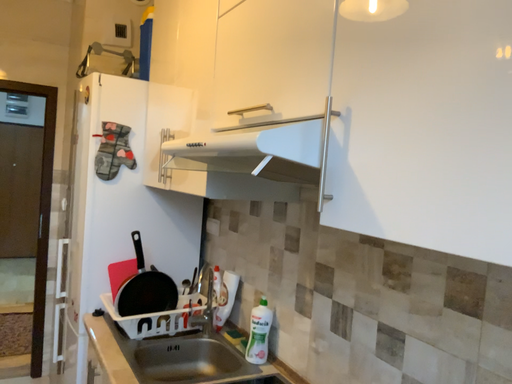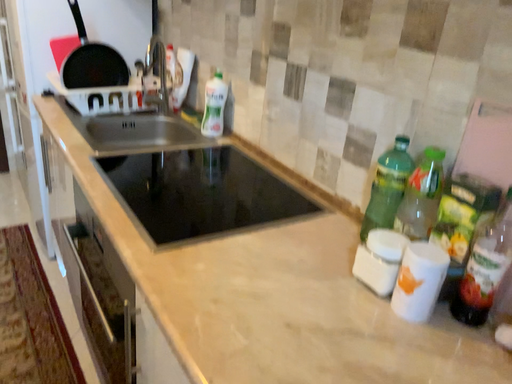
Question: Which way did the camera rotate in the video?

Choices:
 (A) rotated upward
 (B) rotated downward

Answer: (B)